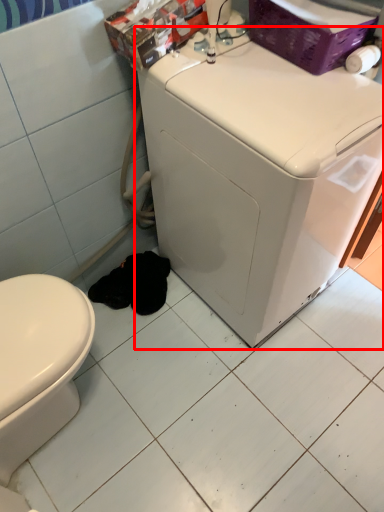
Question: From the image's perspective, what is the correct spatial positioning of washing machine (annotated by the red box) in reference to ceramic tile?

Choices:
 (A) above
 (B) below

Answer: (A)